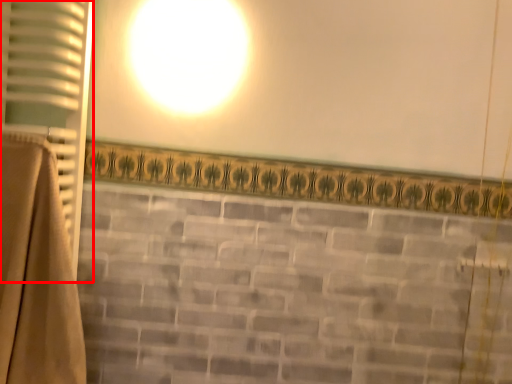
Question: Considering the relative positions of curtain (annotated by the red box) and curtain in the image provided, where is curtain (annotated by the red box) located with respect to the staircase?

Choices:
 (A) right
 (B) left

Answer: (B)